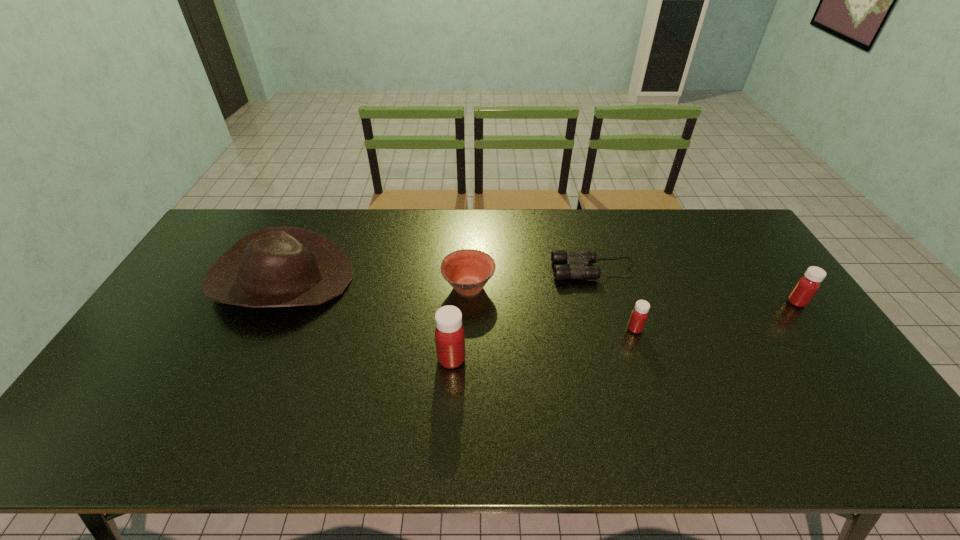
Please point a free position for a medicine on the left. Please provide its 2D coordinates. Your answer should be formatted as a tuple, i.e. [(x, y)], where the tuple contains the x and y coordinates of a point satisfying the conditions above.

[(243, 394)]